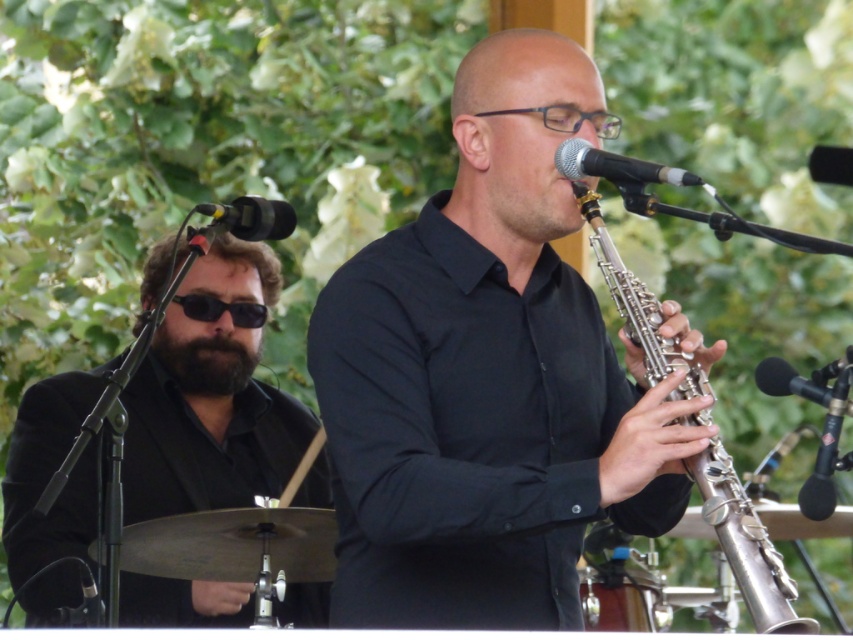
Question: Estimate the real-world distances between objects in this image. Which object is closer to the metallic drum at lower center?

Choices:
 (A) silver metallic oboe at center
 (B) black fuzzy beard at left
 (C) black matte sunglasses at left

Answer: (C)

Question: Which of the following is the farthest from the observer?

Choices:
 (A) silver metallic oboe at center
 (B) black fuzzy beard at left
 (C) metallic silver flute at center

Answer: (B)

Question: Is metallic silver flute at center below silver metallic oboe at center?

Choices:
 (A) no
 (B) yes

Answer: (A)

Question: Does metallic silver flute at center have a greater width compared to metallic drum at lower center?

Choices:
 (A) no
 (B) yes

Answer: (B)

Question: Is the position of metallic silver flute at center less distant than that of black matte sunglasses at left?

Choices:
 (A) no
 (B) yes

Answer: (B)

Question: Which of these objects is positioned farthest from the silver metallic oboe at center?

Choices:
 (A) black matte sunglasses at left
 (B) metallic silver flute at center
 (C) metallic drum at lower center
 (D) black fuzzy beard at left

Answer: (D)